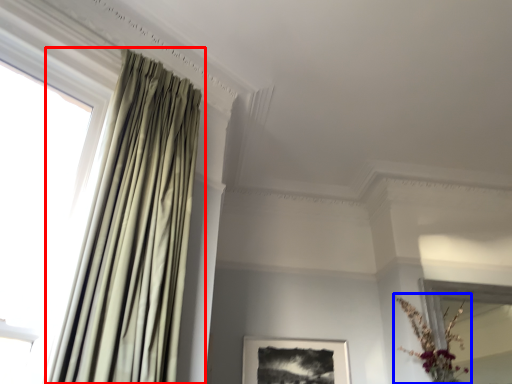
Question: Among these objects, which one is nearest to the camera, curtain (highlighted by a red box) or floral arrangement (highlighted by a blue box)?

Choices:
 (A) curtain
 (B) floral arrangement

Answer: (A)